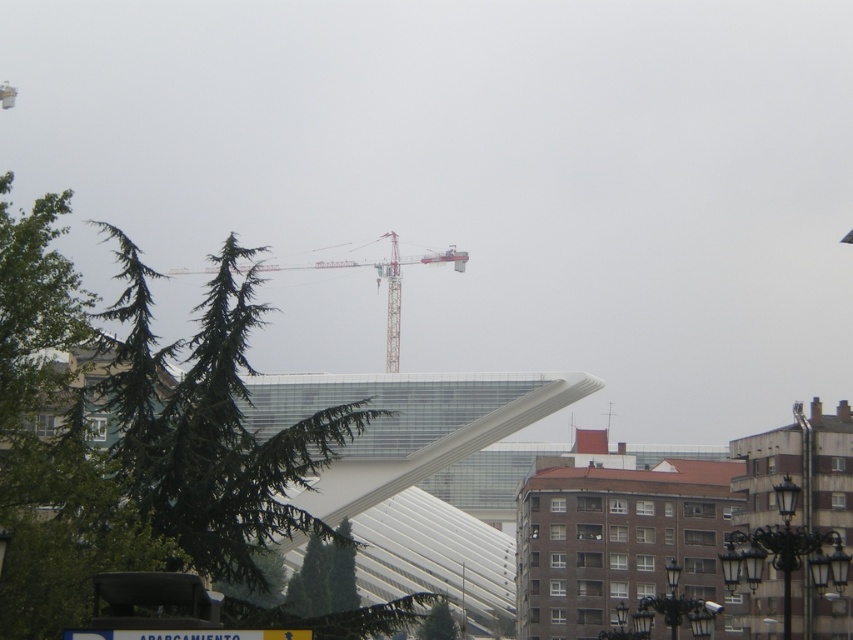
Question: Does green needle-like tree at upper left appear under green matte tree at lower center?

Choices:
 (A) yes
 (B) no

Answer: (B)

Question: Which point appears closest to the camera in this image?

Choices:
 (A) (190, 420)
 (B) (434, 637)
 (C) (459, 266)

Answer: (A)

Question: Which point appears farthest from the camera in this image?

Choices:
 (A) (135, 340)
 (B) (387, 292)

Answer: (B)

Question: Does green needle-like tree at upper left lie behind green matte tree at lower center?

Choices:
 (A) yes
 (B) no

Answer: (B)

Question: Which object is positioned closest to the metallic gray crane at center?

Choices:
 (A) green matte tree at lower center
 (B) green needle-like tree at upper left

Answer: (B)

Question: Can you confirm if metallic gray crane at center is positioned above green matte tree at lower center?

Choices:
 (A) yes
 (B) no

Answer: (A)